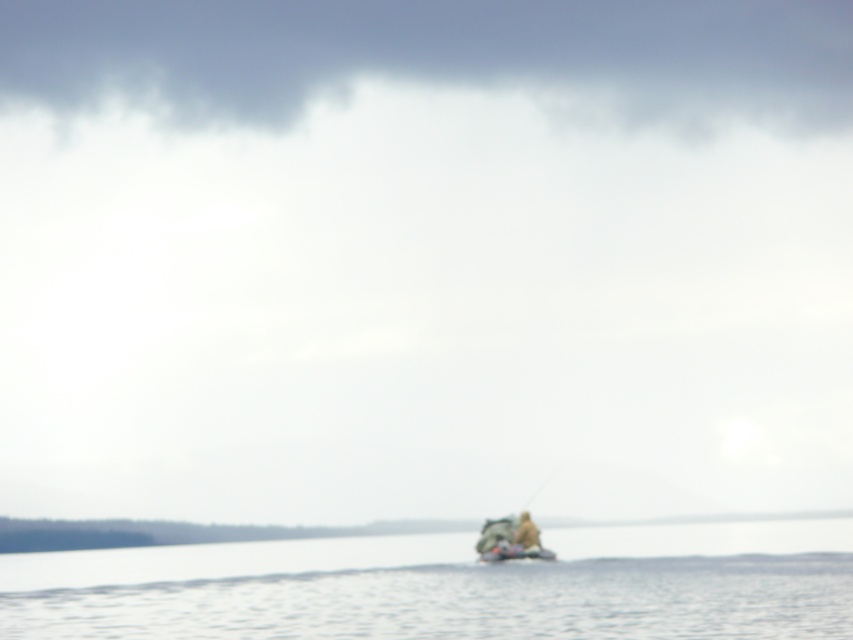
Question: Where is clear water at center located in relation to camouflage fabric canoe at center in the image?

Choices:
 (A) above
 (B) below

Answer: (B)

Question: Which of these objects is positioned closest to the brown fabric person at center?

Choices:
 (A) clear water at center
 (B) camouflage fabric canoe at center
 (C) camouflage fabric boat at lower center

Answer: (C)

Question: Which object is closer to the camera taking this photo?

Choices:
 (A) brown fabric person at center
 (B) camouflage fabric canoe at center
 (C) camouflage fabric boat at lower center
 (D) clear water at center

Answer: (D)

Question: Which of the following is the closest to the observer?

Choices:
 (A) (525, 534)
 (B) (225, 586)
 (C) (490, 561)

Answer: (B)

Question: Does clear water at center appear over camouflage fabric boat at lower center?

Choices:
 (A) no
 (B) yes

Answer: (A)

Question: In this image, where is camouflage fabric boat at lower center located relative to brown fabric person at center?

Choices:
 (A) below
 (B) above

Answer: (A)